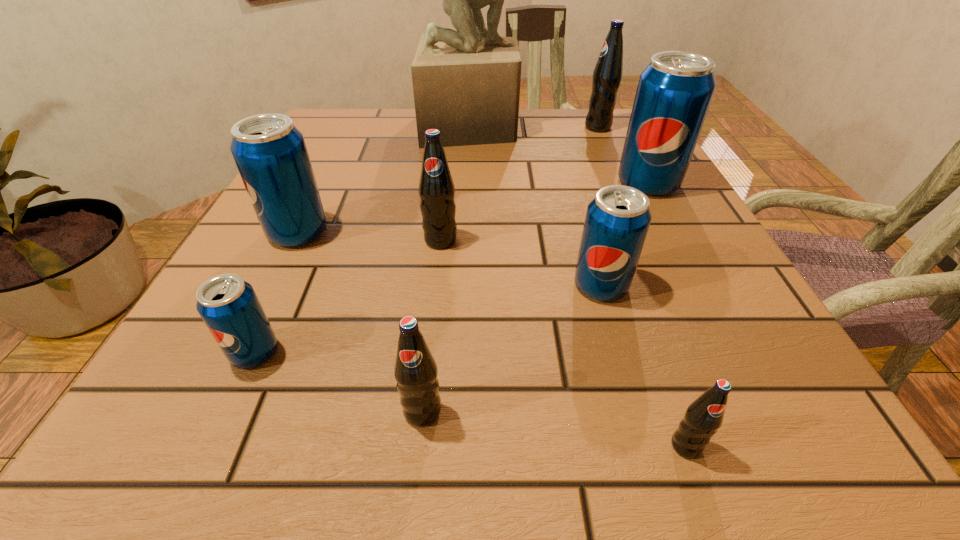
Locate which blue pop soda ranks in proximity to the second biggest blue pop soda. Please provide its 2D coordinates. Your answer should be formatted as a tuple, i.e. [(x, y)], where the tuple contains the x and y coordinates of a point satisfying the conditions above.

[(228, 305)]

Where is `the second closest black pop to the tallest object`? The width and height of the screenshot is (960, 540). the second closest black pop to the tallest object is located at coordinates (436, 187).

Identify the location of black pop object that ranks as the second closest to the gray sculpture. The height and width of the screenshot is (540, 960). (436, 187).

You are a GUI agent. You are given a task and a screenshot of the screen. Output one action in this format:
    pyautogui.click(x=<x>, y=<y>)
    Task: Click on the vacant space that satisfies the following two spatial constraints: 1. on the front-facing side of the tallest object; 2. on the front label of the second farthest black pop
    This screenshot has height=540, width=960.
    Given the screenshot: What is the action you would take?
    click(x=468, y=240)

Where is `free space that satisfies the following two spatial constraints: 1. on the front label of the rightmost black pop; 2. on the front label of the nearest black pop`? This screenshot has width=960, height=540. free space that satisfies the following two spatial constraints: 1. on the front label of the rightmost black pop; 2. on the front label of the nearest black pop is located at coordinates (741, 446).

Locate an element on the screen. The height and width of the screenshot is (540, 960). vacant space that satisfies the following two spatial constraints: 1. on the front label of the rightmost black pop; 2. on the front side of the third nearest pop is located at coordinates 699,352.